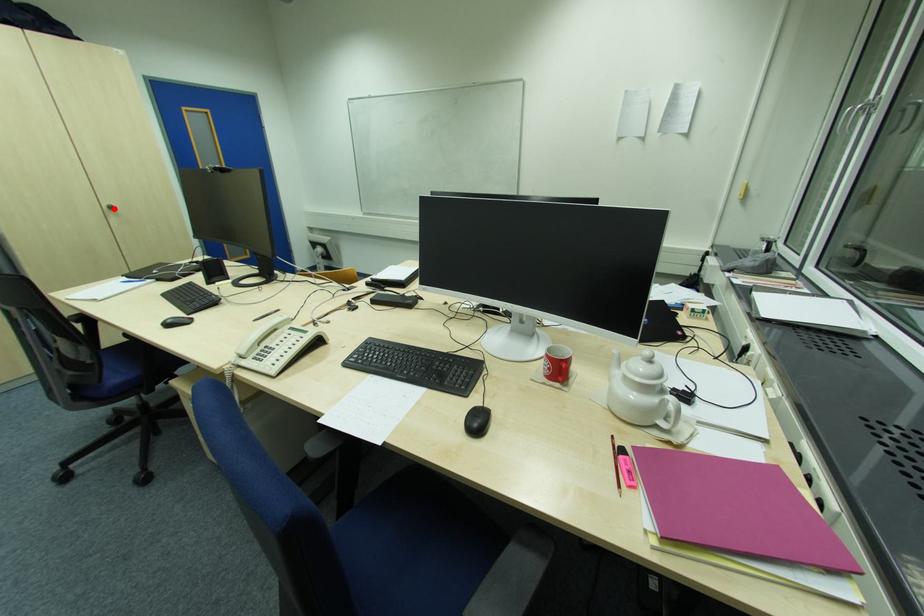
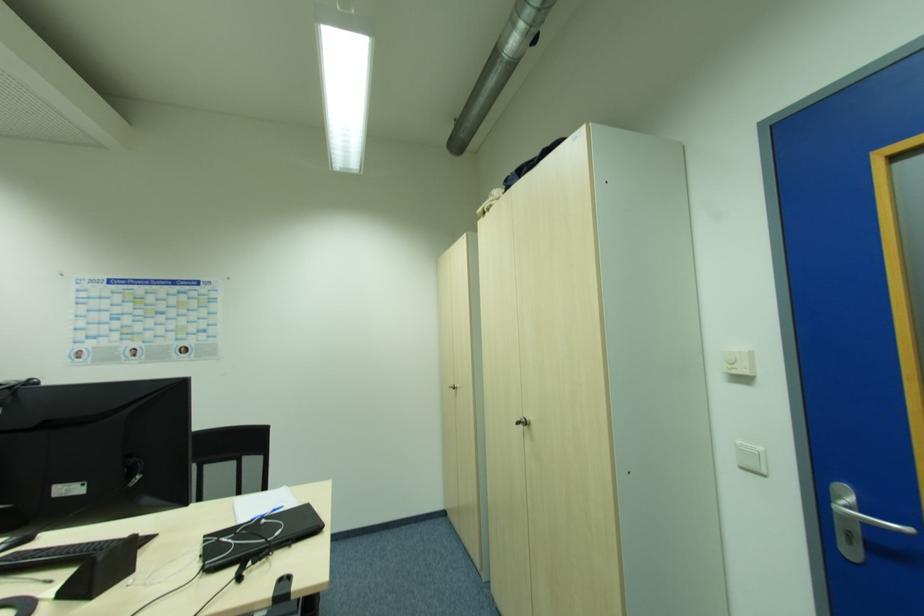
Locate, in the second image, the point that corresponds to the highlighted location in the first image.

(526, 424)